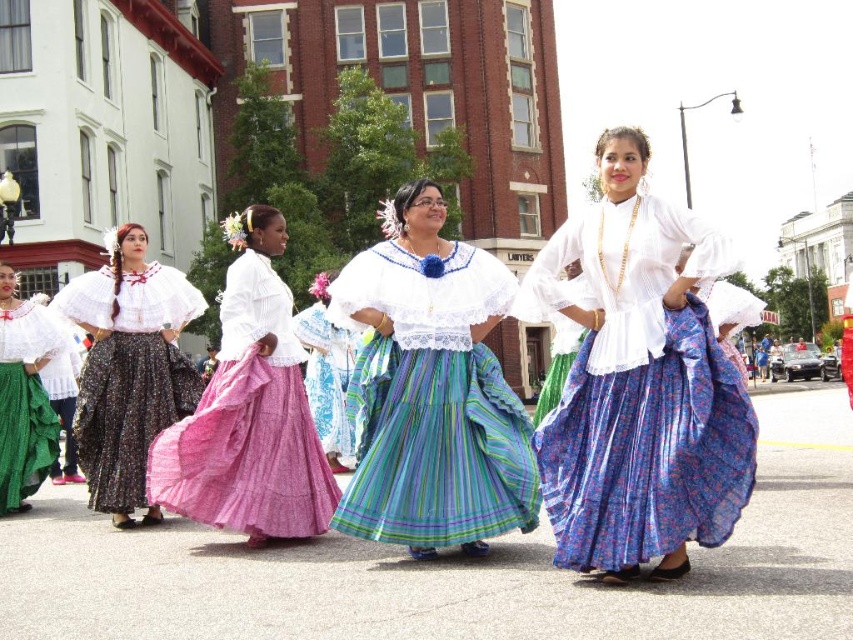
In the vibrant street scene, you notice two outfits worn by participants in the parade. The striped cotton dress at center and the green textured skirt at left. Which outfit is taller?

The striped cotton dress at center is taller than the green textured skirt at left.